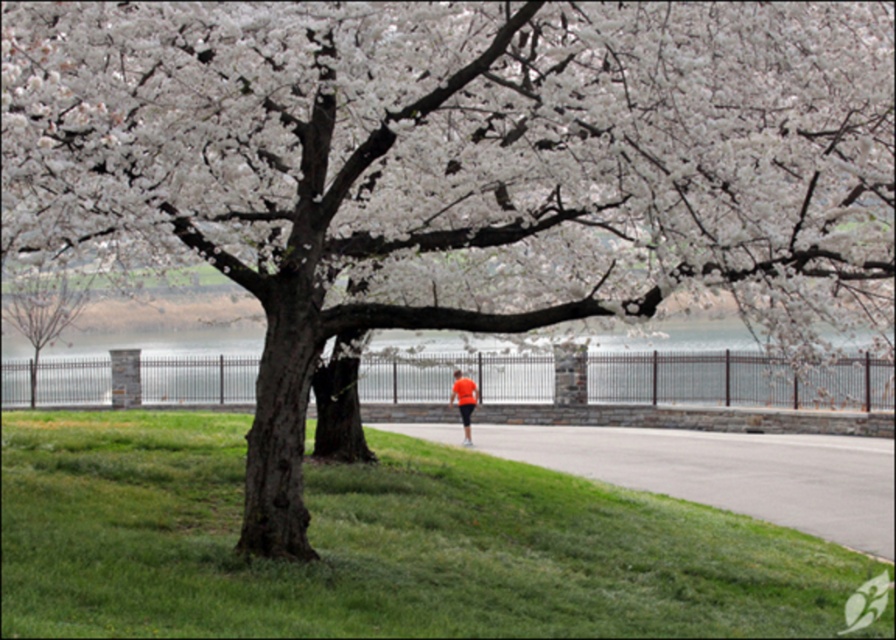
Who is positioned more to the right, gray asphalt pavement at lower center or smooth bark tree at left?

gray asphalt pavement at lower center

Is gray asphalt pavement at lower center above smooth bark tree at left?

Incorrect, gray asphalt pavement at lower center is not positioned above smooth bark tree at left.

Which is in front, point (636, 481) or point (33, 349)?

Point (636, 481)

You are a GUI agent. You are given a task and a screenshot of the screen. Output one action in this format:
    pyautogui.click(x=<x>, y=<y>)
    Task: Click on the gray asphalt pavement at lower center
    This screenshot has width=896, height=640.
    Given the screenshot: What is the action you would take?
    pyautogui.click(x=728, y=472)

Is gray asphalt pavement at lower center taller than orange fabric shorts at center?

No.

Is the position of gray asphalt pavement at lower center less distant than that of orange fabric shorts at center?

That is True.

What are the coordinates of `gray asphalt pavement at lower center` in the screenshot? It's located at (728, 472).

Which is more to the left, smooth bark tree at left or orange fabric shorts at center?

smooth bark tree at left is more to the left.

I want to click on smooth bark tree at left, so click(42, 310).

The height and width of the screenshot is (640, 896). Identify the location of smooth bark tree at left. (42, 310).

What are the coordinates of `smooth bark tree at left` in the screenshot? It's located at (42, 310).